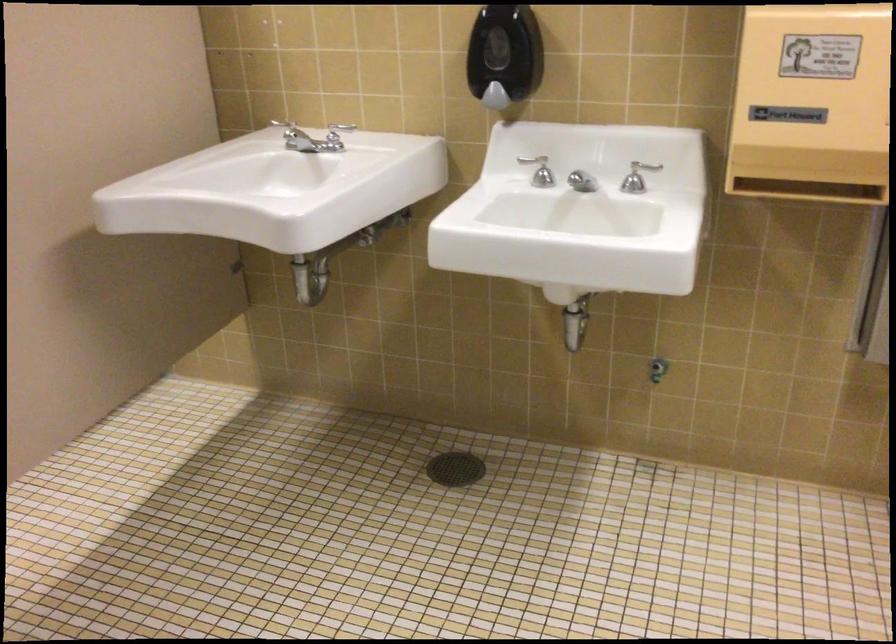
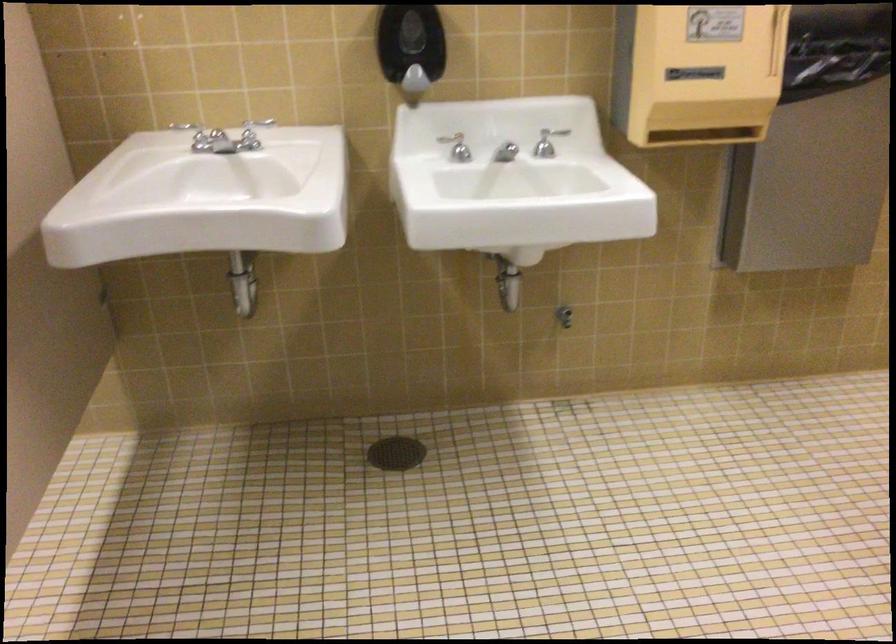
Find the pixel in the second image that matches the point at 642,176 in the first image.

(547, 142)